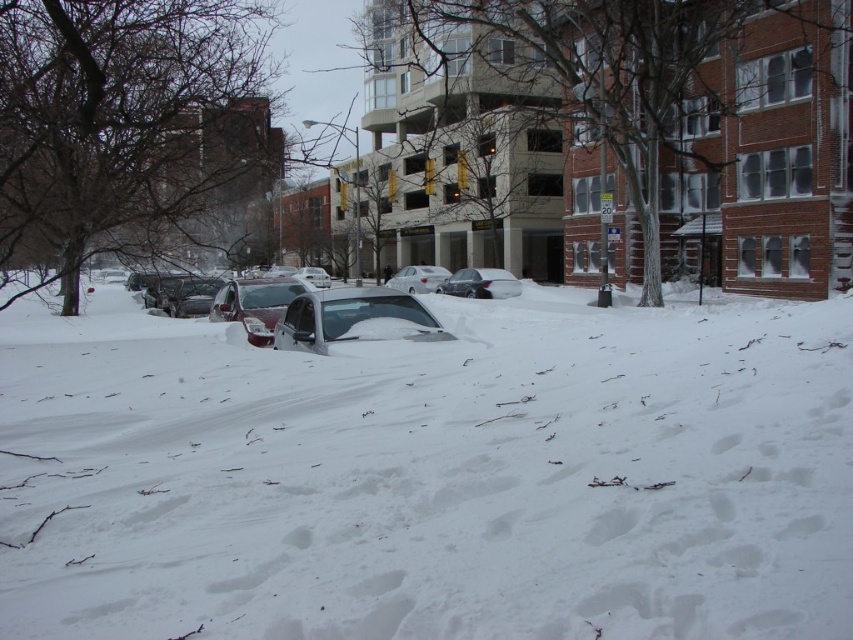
Question: Among these points, which one is nearest to the camera?

Choices:
 (A) (339, 314)
 (B) (421, 269)
 (C) (296, 314)

Answer: (A)

Question: Considering the real-world distances, which object is closest to the white fluffy snow at center?

Choices:
 (A) sleek silver sedan at center
 (B) white matte car at center

Answer: (A)

Question: Does sleek silver sedan at center appear on the left side of metallic silver sedan at center?

Choices:
 (A) yes
 (B) no

Answer: (A)

Question: Does white fluffy snow at center appear under shiny red car at center?

Choices:
 (A) no
 (B) yes

Answer: (B)

Question: Estimate the real-world distances between objects in this image. Which object is closer to the shiny red car at center?

Choices:
 (A) white fluffy snow at center
 (B) metallic silver sedan at center

Answer: (A)

Question: Observing the image, what is the correct spatial positioning of white fluffy snow at center in reference to sleek silver sedan at center?

Choices:
 (A) left
 (B) right

Answer: (B)